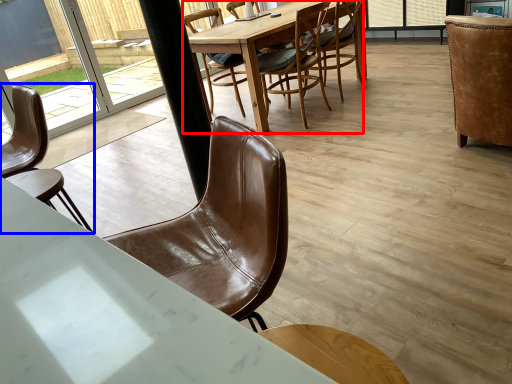
Question: Which object is further to the camera taking this photo, round table (highlighted by a red box) or chair (highlighted by a blue box)?

Choices:
 (A) round table
 (B) chair

Answer: (A)